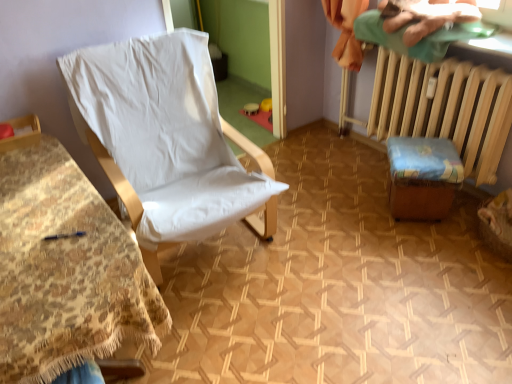
Identify the location of blank space situated above white fabric chair at left, the first furniture positioned from the left (from a real-world perspective). The width and height of the screenshot is (512, 384). (49, 216).